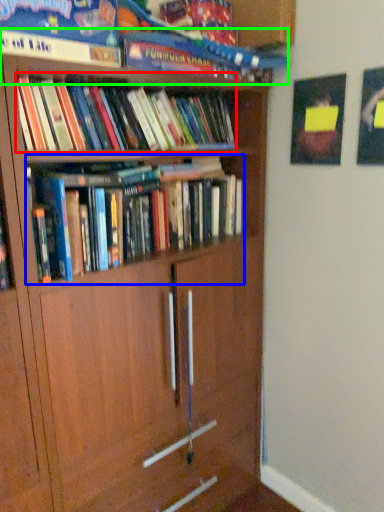
Question: Which is nearer to the book (highlighted by a red box)? book (highlighted by a blue box) or book (highlighted by a green box).

Choices:
 (A) book
 (B) book

Answer: (B)